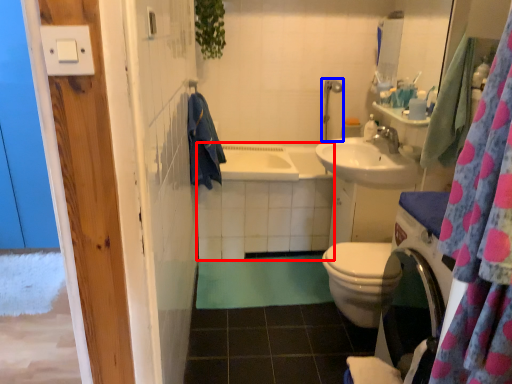
Question: Which object appears closest to the camera in this image, bath (highlighted by a red box) or shower (highlighted by a blue box)?

Choices:
 (A) bath
 (B) shower

Answer: (A)